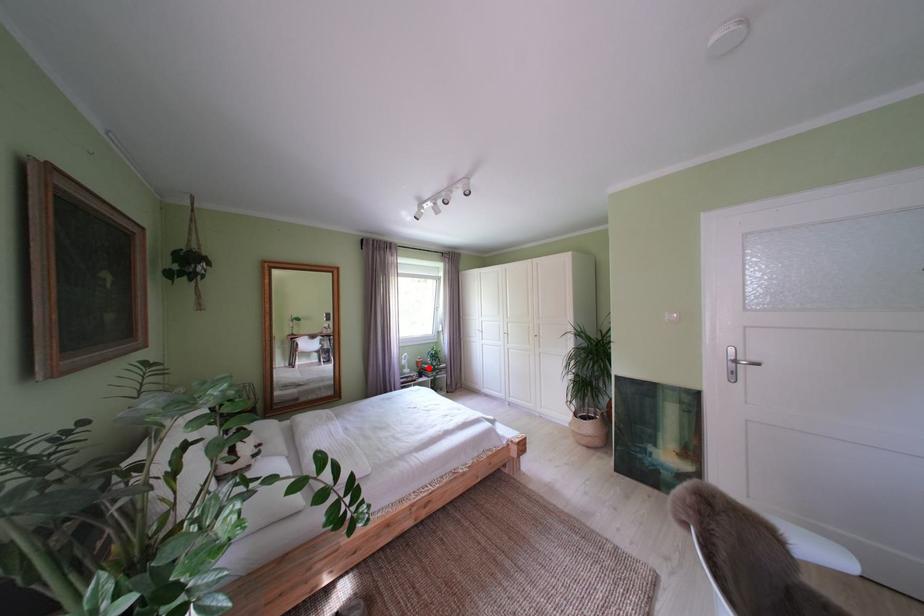
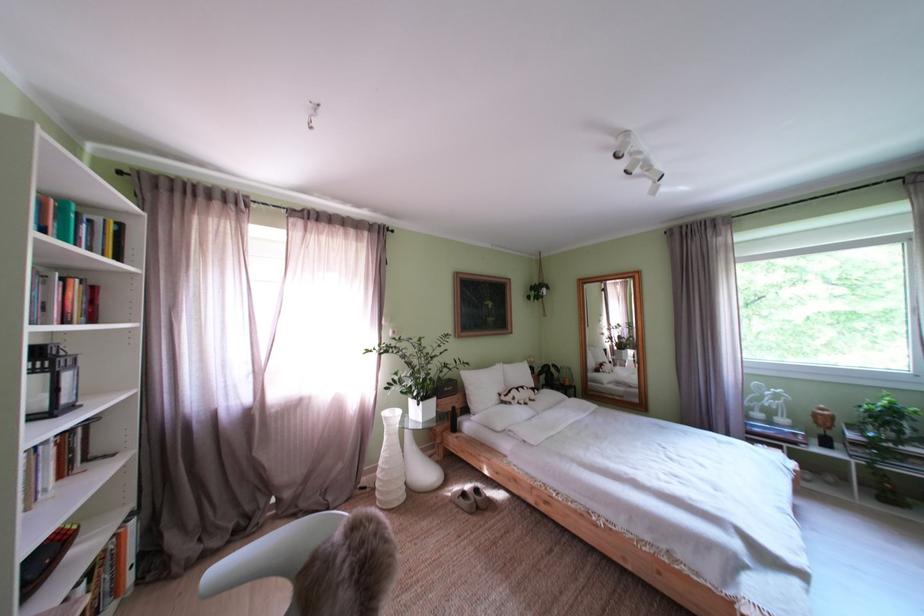
In the second image, find the point that corresponds to the highlighted location in the first image.

(825, 419)